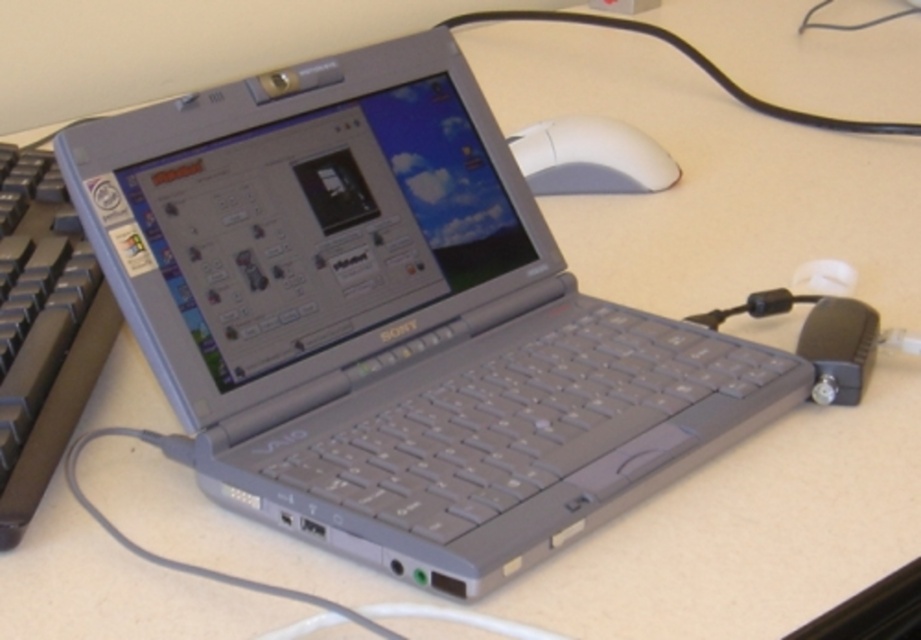
You are a technician examining the Sony VAIO laptop on the desk. You need to locate the gray plastic keyboard at left. Where is it positioned relative to the laptop?

The gray plastic keyboard at left is positioned at the coordinates point (43, 330) relative to the laptop.

From the picture: You are sitting at the desk and want to reach the point that is closer to you. Which point should you choose between point (25, 388) and point (595, 132)?

Point (25, 388) is in front of point (595, 132), so you should choose point (25, 388) as it is closer to you.